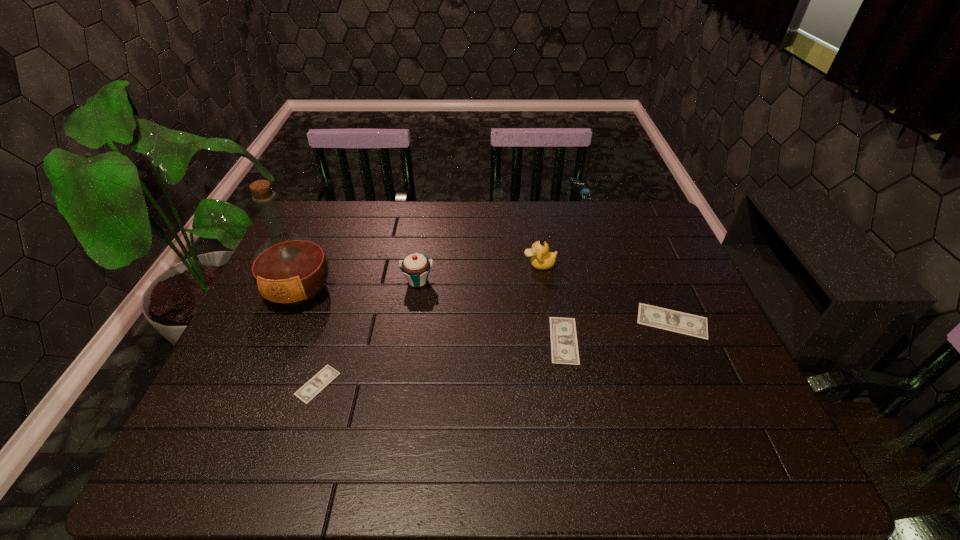
Find the location of `spot to insert another money for uniform distribution`. spot to insert another money for uniform distribution is located at coordinates (446, 361).